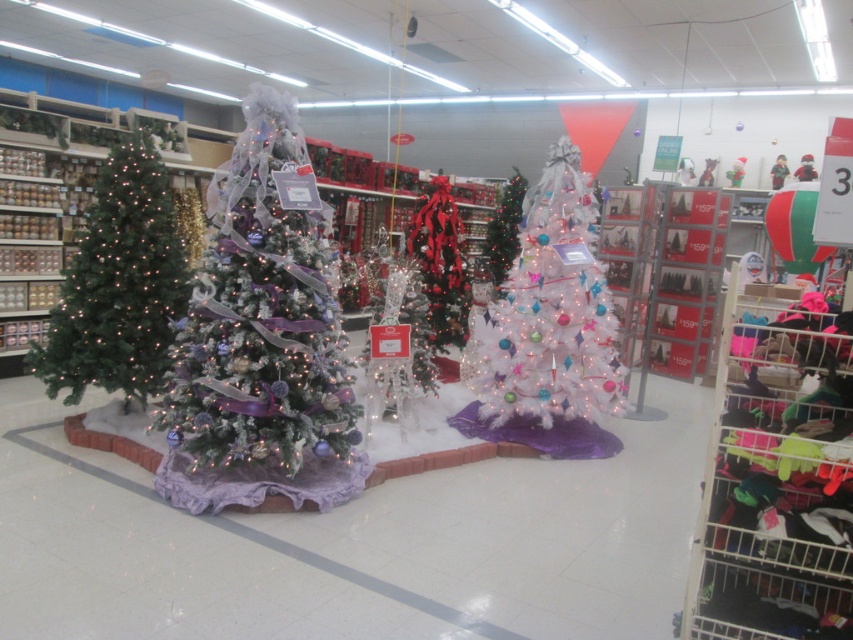
Can you confirm if white glittery christmas tree at center is bigger than green matte christmas tree at left?

Correct, white glittery christmas tree at center is larger in size than green matte christmas tree at left.

Does point (326, 483) come farther from viewer compared to point (62, 344)?

No, it is not.

Image resolution: width=853 pixels, height=640 pixels. What are the coordinates of `white glittery christmas tree at center` in the screenshot? It's located at (263, 339).

Is shiny red ribbon at center taller than white frosted christmas tree at center?

Yes, shiny red ribbon at center is taller than white frosted christmas tree at center.

Is point (428, 218) closer to viewer compared to point (482, 244)?

Yes, it is in front of point (482, 244).

At what (x,y) coordinates should I click in order to perform the action: click on shiny red ribbon at center. Please return your answer as a coordinate pair (x, y). Image resolution: width=853 pixels, height=640 pixels. Looking at the image, I should click on (440, 262).

Is point (331, 355) positioned after point (498, 268)?

No, (331, 355) is in front of (498, 268).

Locate an element on the screen. This screenshot has width=853, height=640. white glittery christmas tree at center is located at coordinates (x=263, y=339).

Between point (241, 212) and point (503, 228), which one is positioned in front?

Point (241, 212) is in front.

Where is `white glittery christmas tree at center`? This screenshot has width=853, height=640. white glittery christmas tree at center is located at coordinates (263, 339).